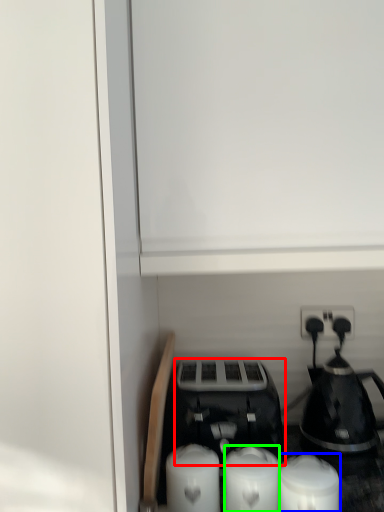
Question: Considering the real-world distances, which object is farthest from toaster (highlighted by a red box)? candle (highlighted by a blue box) or candle (highlighted by a green box)?

Choices:
 (A) candle
 (B) candle

Answer: (A)